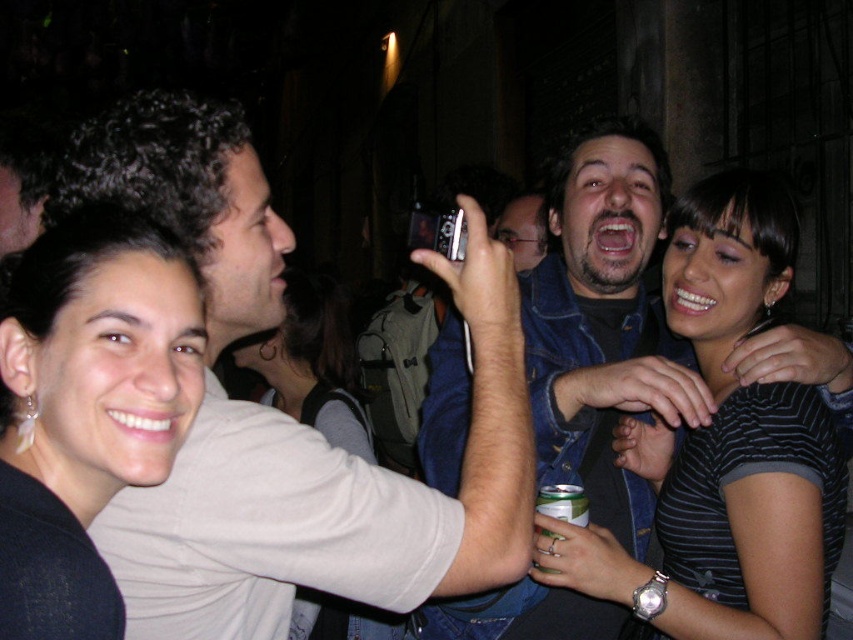
Question: Is striped fabric shirt at center smaller than black matte hair at upper left?

Choices:
 (A) yes
 (B) no

Answer: (B)

Question: Which point appears closest to the camera in this image?

Choices:
 (A) (674, 246)
 (B) (234, 113)

Answer: (B)

Question: Which point is closer to the camera?

Choices:
 (A) (120, 134)
 (B) (769, 385)
 (C) (45, 556)

Answer: (C)

Question: Is matte white shirt at upper left to the right of black matte hair at upper left from the viewer's perspective?

Choices:
 (A) yes
 (B) no

Answer: (A)

Question: Is matte white shirt at upper left thinner than black matte hair at upper left?

Choices:
 (A) yes
 (B) no

Answer: (B)

Question: Considering the real-world distances, which object is farthest from the striped fabric shirt at center?

Choices:
 (A) matte white shirt at upper left
 (B) black matte hair at upper left

Answer: (B)